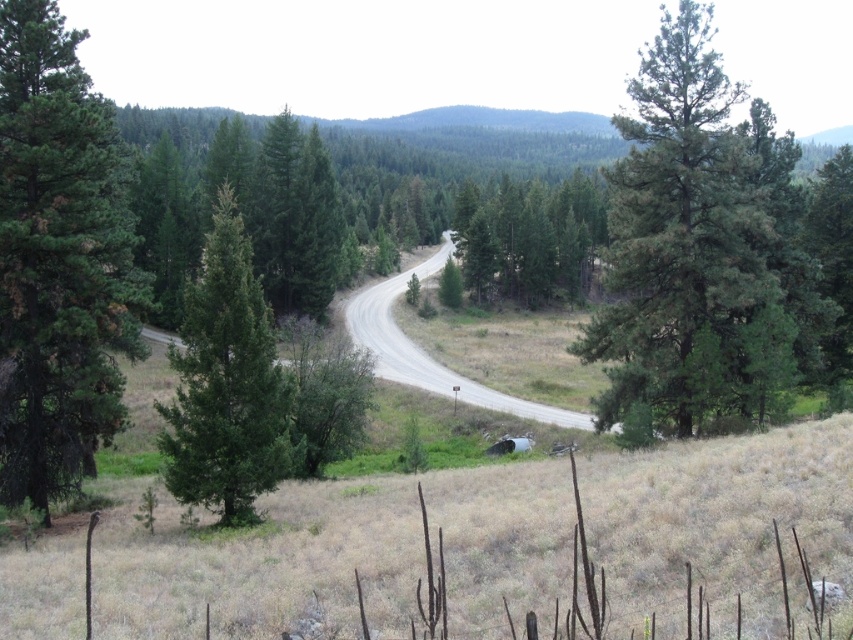
Does point (33, 128) lie behind point (503, 273)?

No, it is in front of (503, 273).

Is point (38, 410) positioned in front of point (602, 234)?

That is True.

The image size is (853, 640). In order to click on green rough bark tree at left in this screenshot , I will do `click(59, 260)`.

Is green needle-like tree at upper right to the right of dark green pine tree at left from the viewer's perspective?

Correct, you'll find green needle-like tree at upper right to the right of dark green pine tree at left.

Describe the element at coordinates (688, 244) in the screenshot. I see `green needle-like tree at upper right` at that location.

Find the location of a particular element. The height and width of the screenshot is (640, 853). green needle-like tree at upper right is located at coordinates (688, 244).

From the picture: Is dark green pine tree at left shorter than green matte tree at center?

Yes, dark green pine tree at left is shorter than green matte tree at center.

Find the location of a particular element. The image size is (853, 640). dark green pine tree at left is located at coordinates (225, 384).